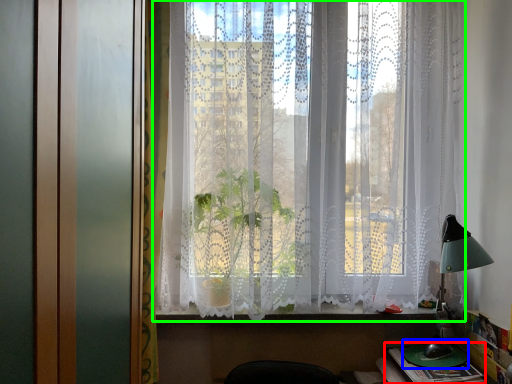
Question: Estimate the real-world distances between objects in this image. Which object is closer to book (highlighted by a red box), round table (highlighted by a blue box) or window (highlighted by a green box)?

Choices:
 (A) round table
 (B) window

Answer: (A)